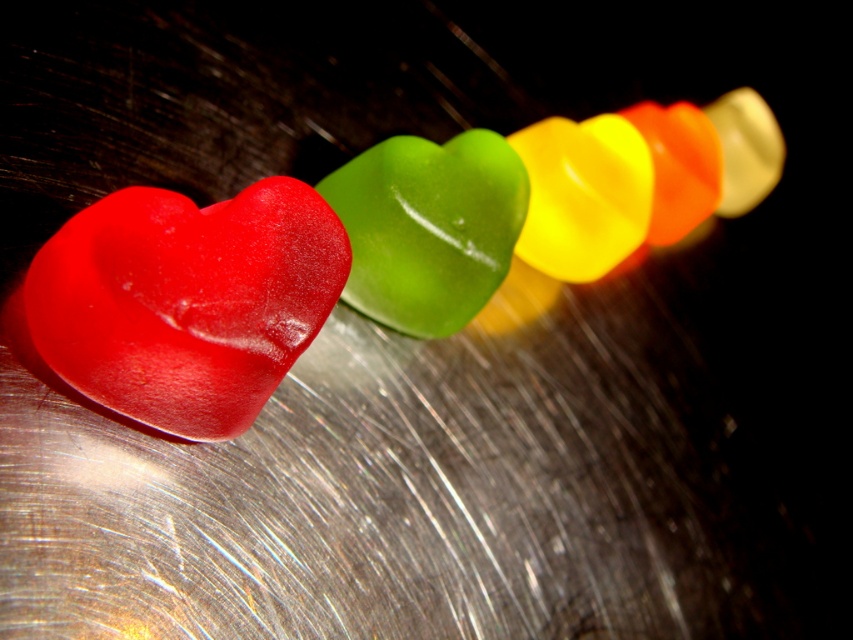
You are a candy store employee who needs to place a new heart candy that is 10 centimeters wide between the glossy gelatin heart at left and the matte red heart at left. Can you fit it there?

The glossy gelatin heart at left is 8.04 centimeters away from the matte red heart at left. Since the new candy is 10 centimeters wide, which is wider than the space between them, it cannot be placed there.

Based on the photo, you are a quality inspector checking the arrangement of candies on a reflective surface. The candies must be placed in a straight line from left to right. According to the image, is the matte red heart at left positioned correctly at the starting point of the line?

The matte red heart at left is located at point (186, 300), which indicates it is positioned correctly at the starting point of the line as required.